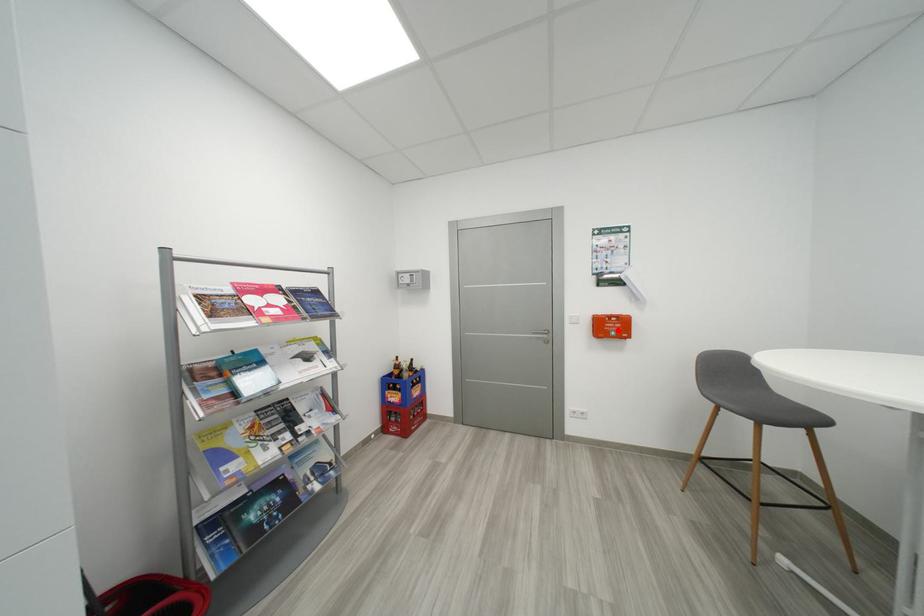
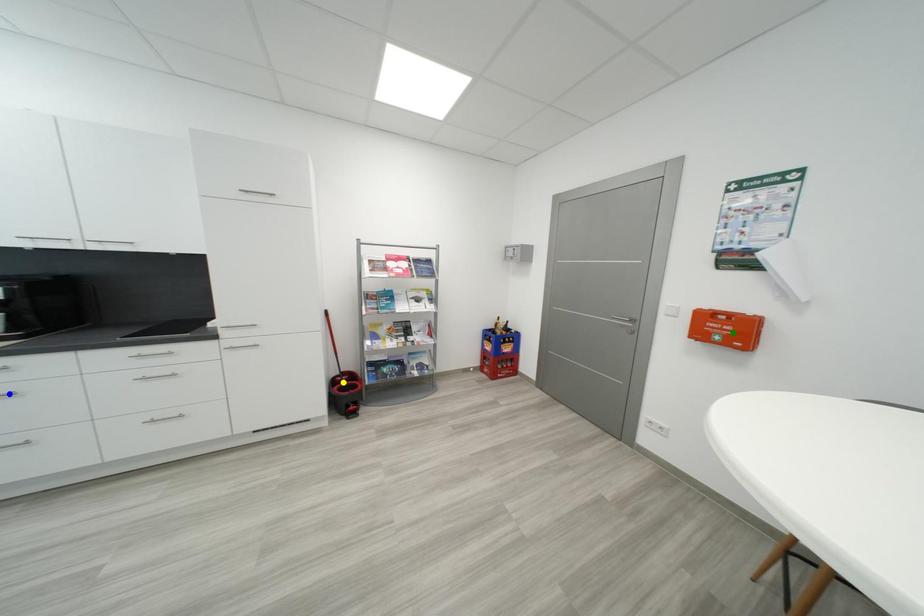
Question: I am providing you with two images of the same scene from different viewpoints. A red point is marked on the first image. You are given multiple points on the second image. Which mark in image 2 goes with the point in image 1?

Choices:
 (A) green point
 (B) yellow point
 (C) blue point

Answer: (A)